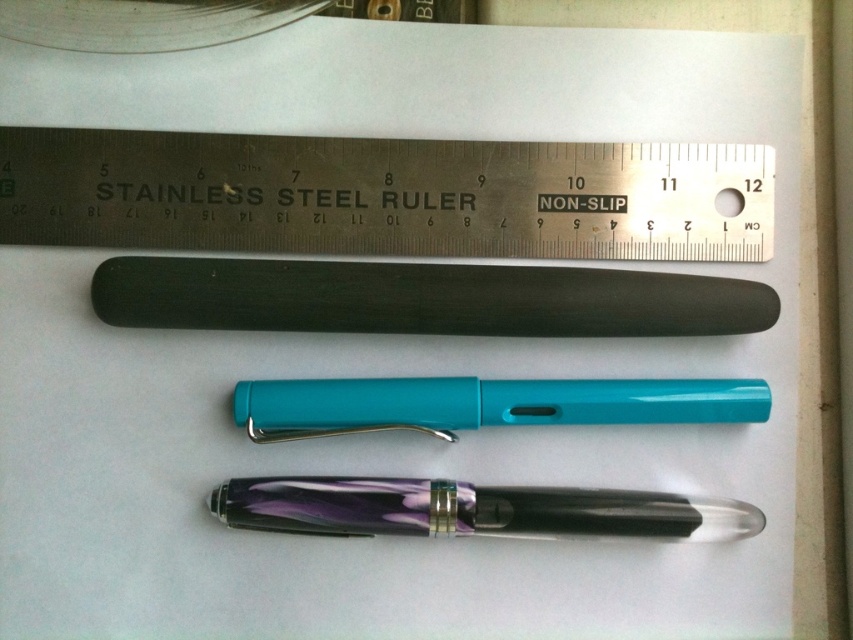
This screenshot has height=640, width=853. Describe the element at coordinates (383, 195) in the screenshot. I see `stainless steel ruler at upper center` at that location.

In the scene shown: How much distance is there between stainless steel ruler at upper center and teal glossy pen at center?

They are 21.60 centimeters apart.

The width and height of the screenshot is (853, 640). What do you see at coordinates (383, 195) in the screenshot? I see `stainless steel ruler at upper center` at bounding box center [383, 195].

You are a GUI agent. You are given a task and a screenshot of the screen. Output one action in this format:
    pyautogui.click(x=<x>, y=<y>)
    Task: Click on the stainless steel ruler at upper center
    The width and height of the screenshot is (853, 640).
    Given the screenshot: What is the action you would take?
    pyautogui.click(x=383, y=195)

Is black rubberized pen at center to the right of translucent purple pen at center from the viewer's perspective?

Incorrect, black rubberized pen at center is not on the right side of translucent purple pen at center.

Where is `black rubberized pen at center`? black rubberized pen at center is located at coordinates (422, 298).

Where is `black rubberized pen at center`? Image resolution: width=853 pixels, height=640 pixels. black rubberized pen at center is located at coordinates (422, 298).

Find the location of a particular element. black rubberized pen at center is located at coordinates (422, 298).

Can you confirm if translucent purple pen at center is positioned below teal glossy pen at center?

Yes.

Who is taller, translucent purple pen at center or teal glossy pen at center?

teal glossy pen at center

Between point (546, 531) and point (669, 413), which one is positioned behind?

The point (546, 531) is more distant.

Identify the location of translucent purple pen at center. This screenshot has width=853, height=640. (473, 509).